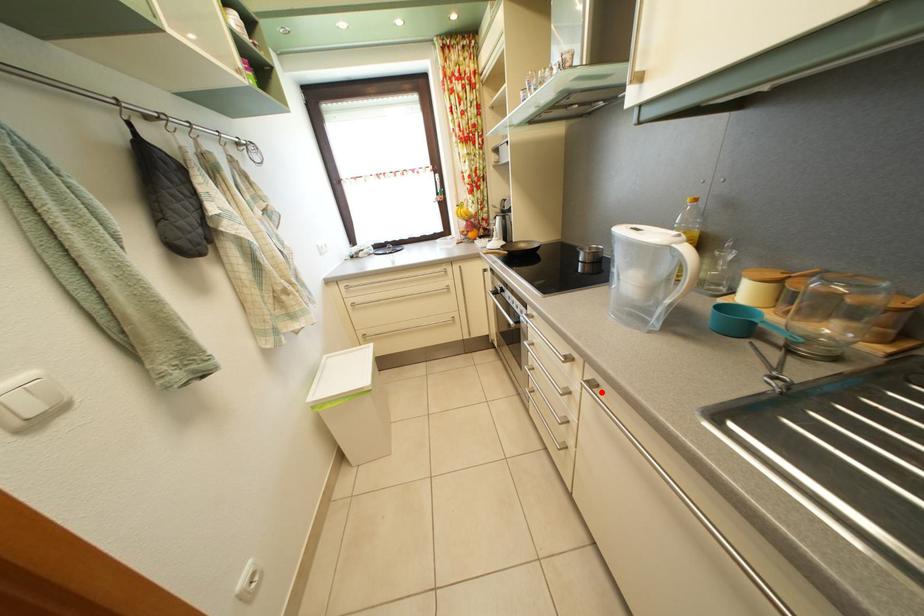
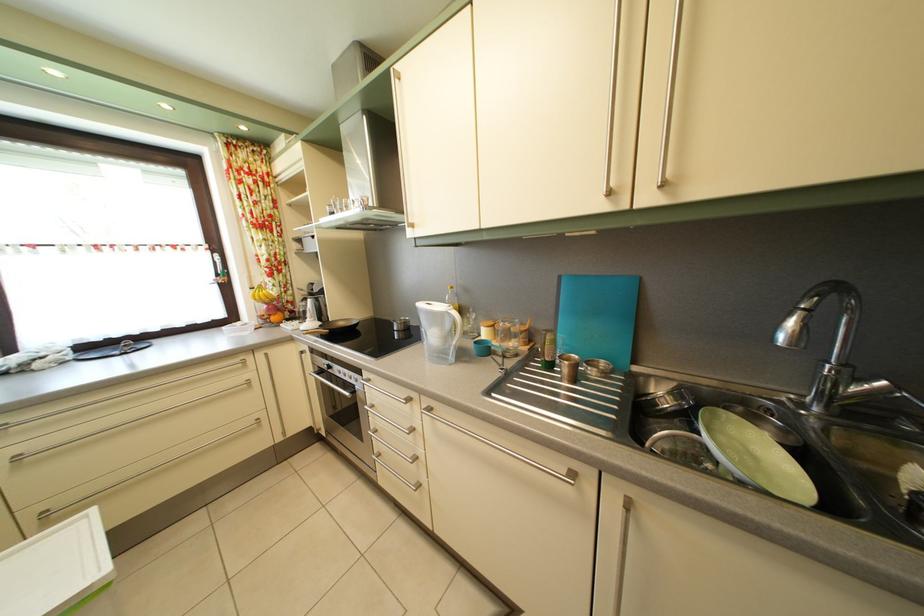
Question: I am providing you with two images of the same scene from different viewpoints. A red point is marked on the first image. Is the red point's position out of view in image 2?

Choices:
 (A) Yes
 (B) No

Answer: (B)